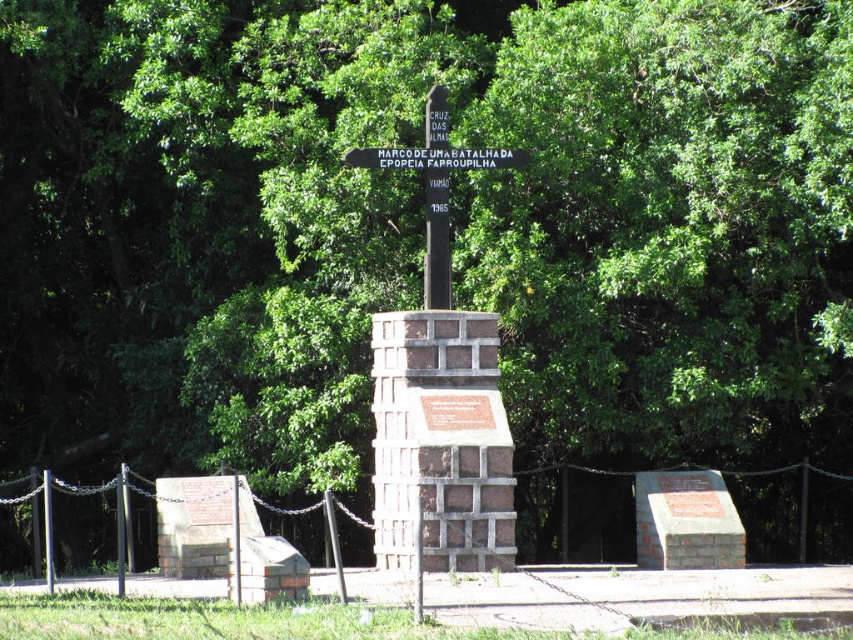
Question: Is brown brick monument at center bigger than black polished wood signpost at center?

Choices:
 (A) yes
 (B) no

Answer: (A)

Question: Estimate the real-world distances between objects in this image. Which object is farther from the brown brick monument at center?

Choices:
 (A) black polished wood signpost at center
 (B) white plastic sign at center

Answer: (B)

Question: Which point is closer to the camera taking this photo?

Choices:
 (A) (432, 225)
 (B) (386, 157)
 (C) (432, 236)

Answer: (C)

Question: Does brown brick monument at center appear on the left side of black polished wood signpost at center?

Choices:
 (A) no
 (B) yes

Answer: (A)

Question: Which of the following is the closest to the observer?

Choices:
 (A) (355, 150)
 (B) (486, 154)

Answer: (A)

Question: Can you confirm if brown brick monument at center is positioned above white plastic sign at center?

Choices:
 (A) yes
 (B) no

Answer: (B)